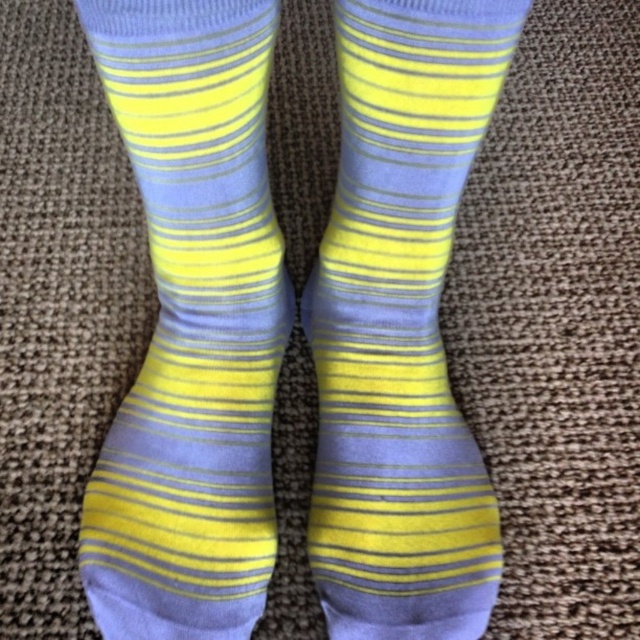
Question: Can you confirm if matte yellow-blue striped sock at center is positioned to the left of yellow striped sock at center?

Choices:
 (A) no
 (B) yes

Answer: (B)

Question: Does matte yellow-blue striped sock at center have a larger size compared to yellow striped sock at center?

Choices:
 (A) no
 (B) yes

Answer: (A)

Question: Does matte yellow-blue striped sock at center appear under yellow striped sock at center?

Choices:
 (A) no
 (B) yes

Answer: (B)

Question: Which of the following is the closest to the observer?

Choices:
 (A) yellow striped sock at center
 (B) matte yellow-blue striped sock at center

Answer: (B)